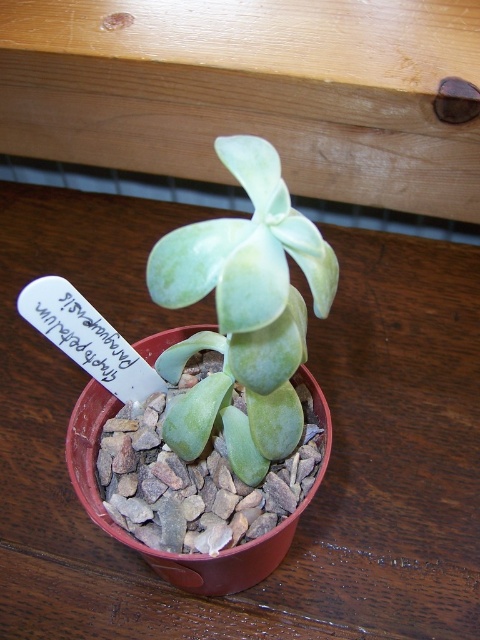
Which of these two, green succulent at center or gray gravel at center, stands shorter?

gray gravel at center

Between point (229, 445) and point (133, 508), which one is positioned in front?

Point (229, 445)

Identify the location of green succulent at center. (245, 308).